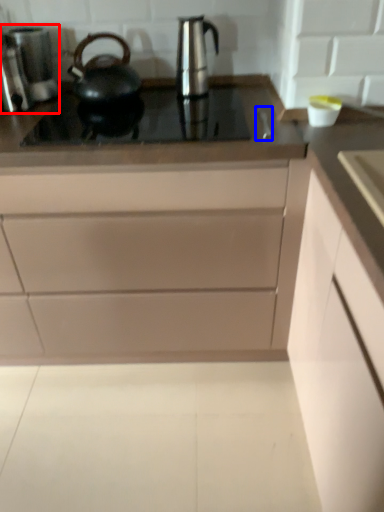
Question: Which of the following is the farthest to the observer, coffee machine (highlighted by a red box) or faucet (highlighted by a blue box)?

Choices:
 (A) coffee machine
 (B) faucet

Answer: (A)